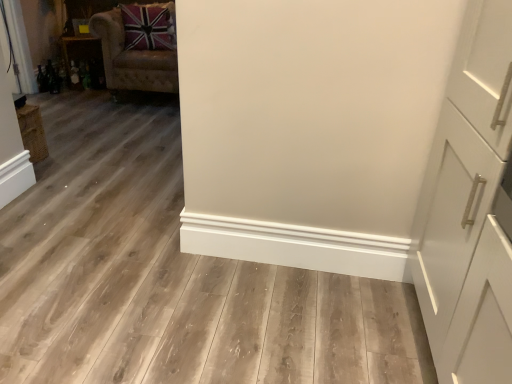
Question: Is wooden shelf at left closer to camera compared to velvet beige armchair at upper left?

Choices:
 (A) no
 (B) yes

Answer: (A)

Question: Is wooden shelf at left beside velvet beige armchair at upper left?

Choices:
 (A) yes
 (B) no

Answer: (B)

Question: Considering the relative sizes of wooden shelf at left and velvet beige armchair at upper left in the image provided, is wooden shelf at left wider than velvet beige armchair at upper left?

Choices:
 (A) yes
 (B) no

Answer: (B)

Question: Could you tell me if wooden shelf at left is turned towards velvet beige armchair at upper left?

Choices:
 (A) no
 (B) yes

Answer: (B)

Question: Is wooden shelf at left to the right of velvet beige armchair at upper left from the viewer's perspective?

Choices:
 (A) yes
 (B) no

Answer: (B)

Question: From a real-world perspective, is wooden shelf at left positioned under velvet beige armchair at upper left based on gravity?

Choices:
 (A) yes
 (B) no

Answer: (A)

Question: Is velvet beige armchair at upper left outside of wooden shelf at left?

Choices:
 (A) no
 (B) yes

Answer: (B)

Question: Is wooden shelf at left completely or partially inside velvet beige armchair at upper left?

Choices:
 (A) yes
 (B) no

Answer: (B)

Question: Can you confirm if velvet beige armchair at upper left is shorter than wooden shelf at left?

Choices:
 (A) yes
 (B) no

Answer: (B)

Question: From a real-world perspective, is velvet beige armchair at upper left on wooden shelf at left?

Choices:
 (A) yes
 (B) no

Answer: (A)

Question: Is velvet beige armchair at upper left behind wooden shelf at left?

Choices:
 (A) yes
 (B) no

Answer: (B)

Question: Is velvet beige armchair at upper left at the left side of wooden shelf at left?

Choices:
 (A) no
 (B) yes

Answer: (A)

Question: Based on their positions, is velvet beige armchair at upper left located to the left or right of wooden shelf at left?

Choices:
 (A) left
 (B) right

Answer: (B)